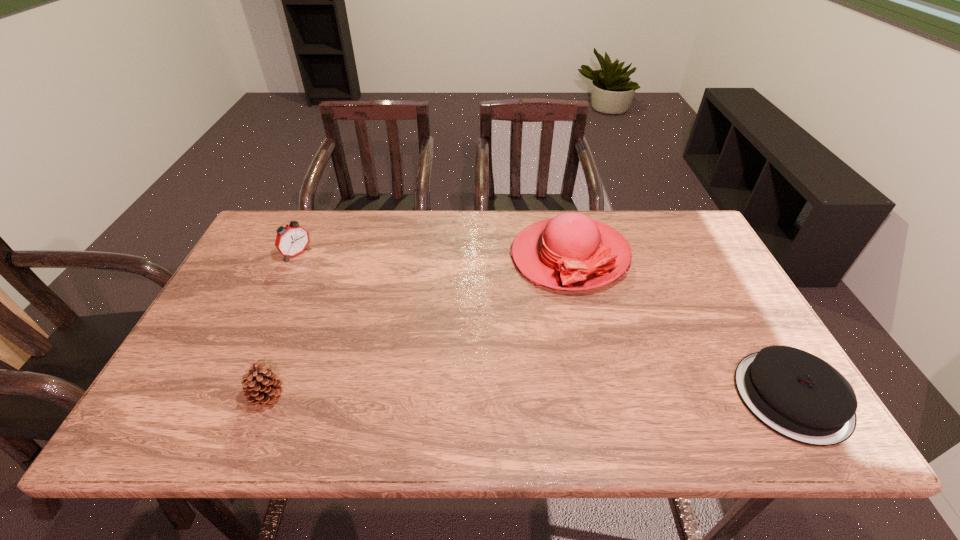
Find the location of a particular element. The image size is (960, 540). free location located on the clock face of the alarm clock is located at coordinates (367, 313).

Locate an element on the screen. free space located at the front of the hat with a bow is located at coordinates (526, 370).

Identify the location of vacant space situated 0.330m at the front of the hat with a bow. The height and width of the screenshot is (540, 960). 518,391.

What are the coordinates of `vacant area situated 0.210m at the front of the hat with a bow` in the screenshot? It's located at (533, 352).

The height and width of the screenshot is (540, 960). What are the coordinates of `alarm clock that is at the far edge` in the screenshot? It's located at (291, 240).

Locate an element on the screen. hat present at the far edge is located at coordinates (571, 251).

What are the coordinates of `pinecone that is at the near edge` in the screenshot? It's located at (261, 387).

Find the location of `pancake at the near edge`. pancake at the near edge is located at coordinates (799, 396).

The image size is (960, 540). Find the location of `object that is positioned at the left edge`. object that is positioned at the left edge is located at coordinates (291, 240).

The height and width of the screenshot is (540, 960). What are the coordinates of `object at the right edge` in the screenshot? It's located at (799, 396).